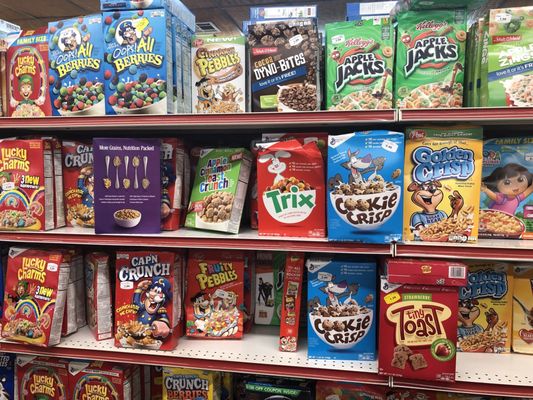
Find the location of a particular element. shelves is located at coordinates (287, 376), (281, 250), (271, 116), (4, 393).